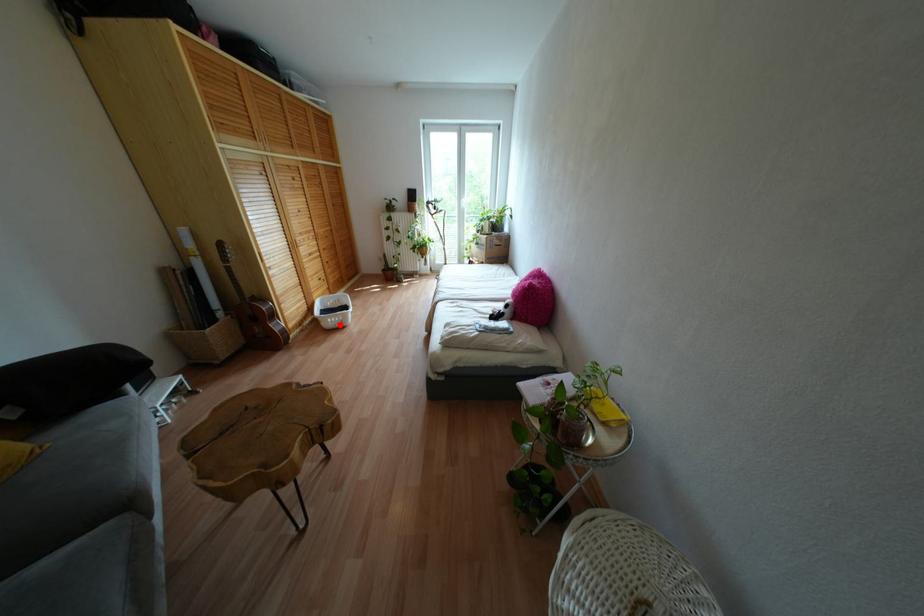
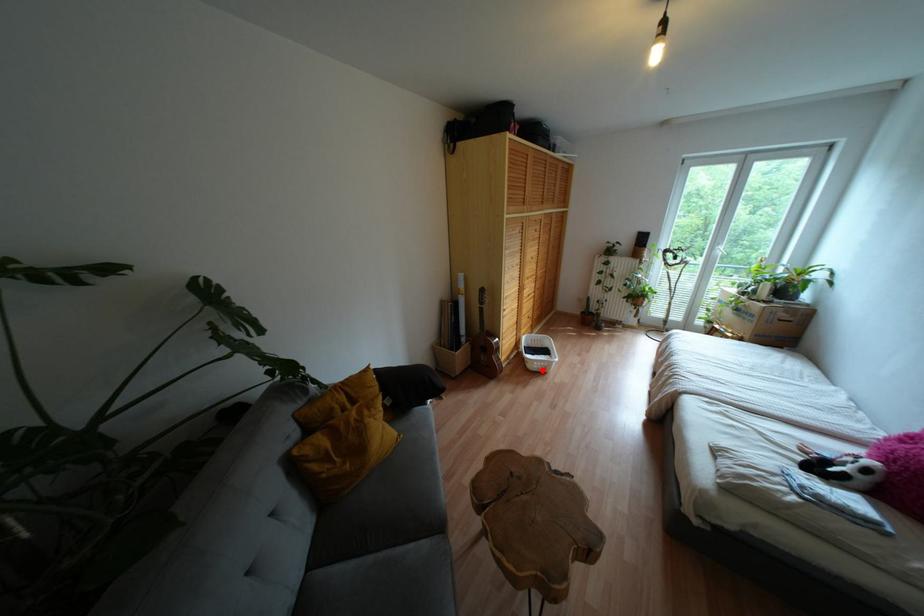
I am providing you with two images of the same scene from different viewpoints. A red point is marked on the first image and another point is marked on the second image. Do the highlighted points in image1 and image2 indicate the same real-world spot?

Yes